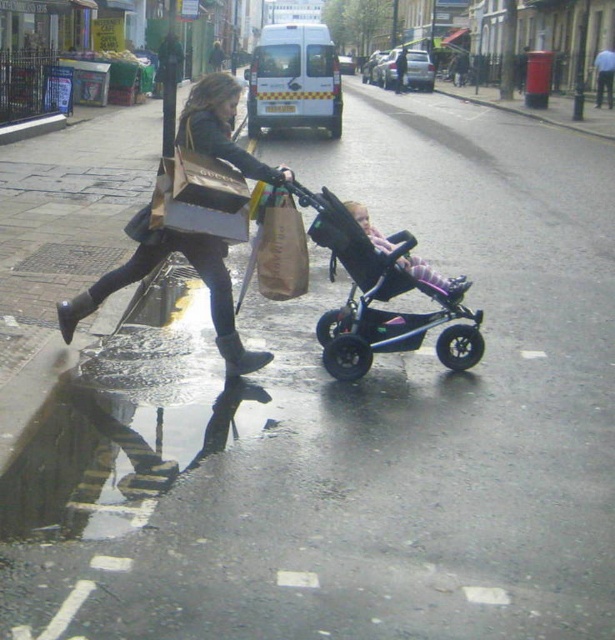
Who is positioned more to the left, matte black jacket at center or brown paper bag at center?

matte black jacket at center

Is matte black jacket at center smaller than brown paper bag at center?

No.

Does point (188, 248) come closer to viewer compared to point (271, 198)?

Yes, point (188, 248) is closer to viewer.

At what (x,y) coordinates should I click in order to perform the action: click on matte black jacket at center. Please return your answer as a coordinate pair (x, y). This screenshot has height=640, width=615. Looking at the image, I should click on (189, 262).

Who is more forward, (263, 296) or (359, 221)?

Point (359, 221) is more forward.

Is brown paper bag at center smaller than soft pink fabric stroller at center?

Yes.

What do you see at coordinates (279, 246) in the screenshot? This screenshot has height=640, width=615. I see `brown paper bag at center` at bounding box center [279, 246].

At what (x,y) coordinates should I click in order to perform the action: click on brown paper bag at center. Please return your answer as a coordinate pair (x, y). The image size is (615, 640). Looking at the image, I should click on (279, 246).

Is black plastic stroller at center to the left of brown suede rain boot at lower center from the viewer's perspective?

In fact, black plastic stroller at center is to the right of brown suede rain boot at lower center.

Can you confirm if black plastic stroller at center is smaller than brown suede rain boot at lower center?

Actually, black plastic stroller at center might be larger than brown suede rain boot at lower center.

Between point (355, 272) and point (234, 364), which one is positioned in front?

Point (234, 364) is in front.

Locate an element on the screen. black plastic stroller at center is located at coordinates (381, 296).